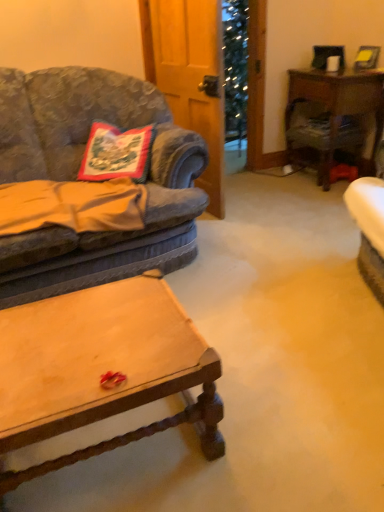
I want to click on free spot in front of wooden desk at right, so click(x=311, y=200).